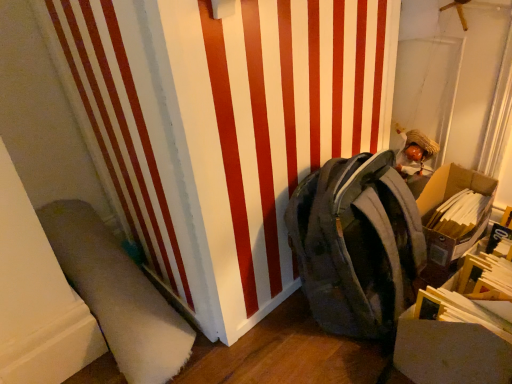
Question: Is camouflage fabric backpack at center-right at the back of white soft carpet at lower left?

Choices:
 (A) yes
 (B) no

Answer: (B)

Question: Can you confirm if white soft carpet at lower left is positioned to the right of camouflage fabric backpack at center-right?

Choices:
 (A) yes
 (B) no

Answer: (B)

Question: Does white soft carpet at lower left lie in front of camouflage fabric backpack at center-right?

Choices:
 (A) yes
 (B) no

Answer: (B)

Question: From the image's perspective, is white soft carpet at lower left located above camouflage fabric backpack at center-right?

Choices:
 (A) yes
 (B) no

Answer: (B)

Question: From a real-world perspective, does white soft carpet at lower left sit lower than camouflage fabric backpack at center-right?

Choices:
 (A) yes
 (B) no

Answer: (A)

Question: Is white soft carpet at lower left with camouflage fabric backpack at center-right?

Choices:
 (A) no
 (B) yes

Answer: (A)

Question: Are cardboard box at right and white soft carpet at lower left located far from each other?

Choices:
 (A) yes
 (B) no

Answer: (B)

Question: Is cardboard box at right surrounding white soft carpet at lower left?

Choices:
 (A) no
 (B) yes

Answer: (A)

Question: Is cardboard box at right looking in the opposite direction of white soft carpet at lower left?

Choices:
 (A) no
 (B) yes

Answer: (A)

Question: From the image's perspective, is cardboard box at right above white soft carpet at lower left?

Choices:
 (A) yes
 (B) no

Answer: (A)

Question: Can you confirm if cardboard box at right is positioned to the right of white soft carpet at lower left?

Choices:
 (A) yes
 (B) no

Answer: (A)

Question: From a real-world perspective, is cardboard box at right over white soft carpet at lower left?

Choices:
 (A) no
 (B) yes

Answer: (A)

Question: From a real-world perspective, is cardboard box at right on top of camouflage fabric backpack at center-right?

Choices:
 (A) no
 (B) yes

Answer: (A)